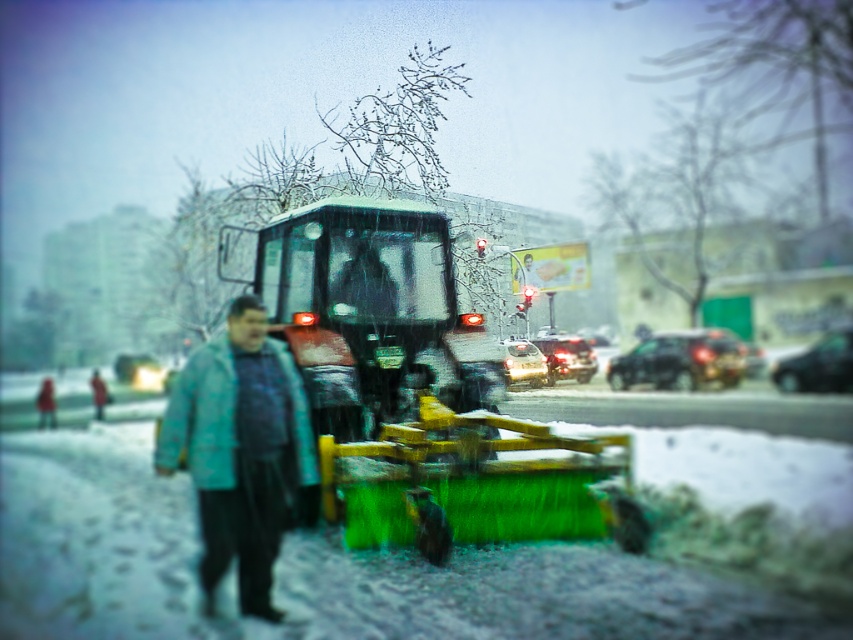
Question: Does teal fabric jacket at center have a lesser width compared to matte blue jacket at center?

Choices:
 (A) no
 (B) yes

Answer: (B)

Question: Is teal fabric jacket at center below matte blue jacket at center?

Choices:
 (A) yes
 (B) no

Answer: (B)

Question: In this image, where is teal fabric jacket at center located relative to matte blue jacket at center?

Choices:
 (A) left
 (B) right

Answer: (B)

Question: Which point is closer to the camera?

Choices:
 (A) (166, 406)
 (B) (103, 403)

Answer: (A)